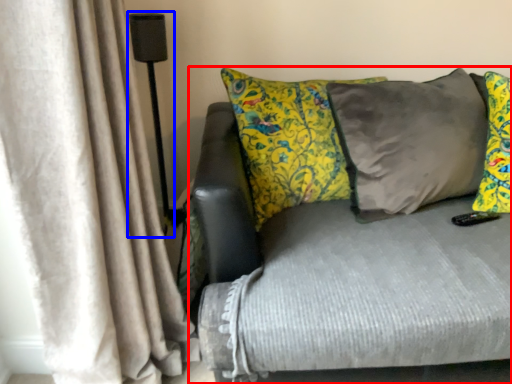
Question: Which object is closer to the camera taking this photo, studio couch (highlighted by a red box) or lamp (highlighted by a blue box)?

Choices:
 (A) studio couch
 (B) lamp

Answer: (A)